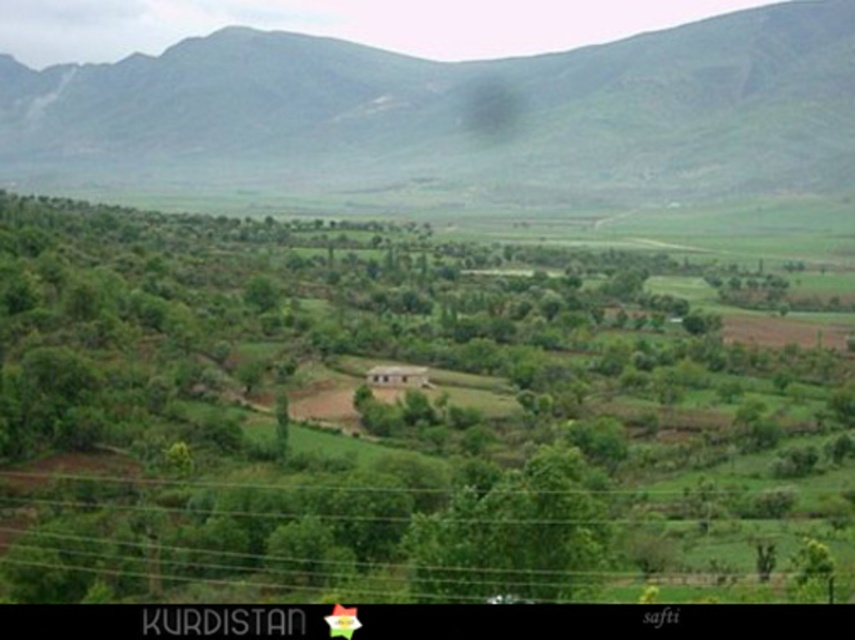
Question: Which point is closer to the camera taking this photo?

Choices:
 (A) (833, 435)
 (B) (392, 88)

Answer: (A)

Question: Can you confirm if green leafy tree at center is positioned below green grassy mountain at upper center?

Choices:
 (A) no
 (B) yes

Answer: (B)

Question: Is green leafy tree at center wider than green grassy mountain at upper center?

Choices:
 (A) no
 (B) yes

Answer: (A)

Question: Does green leafy tree at center appear on the right side of green grassy mountain at upper center?

Choices:
 (A) yes
 (B) no

Answer: (A)